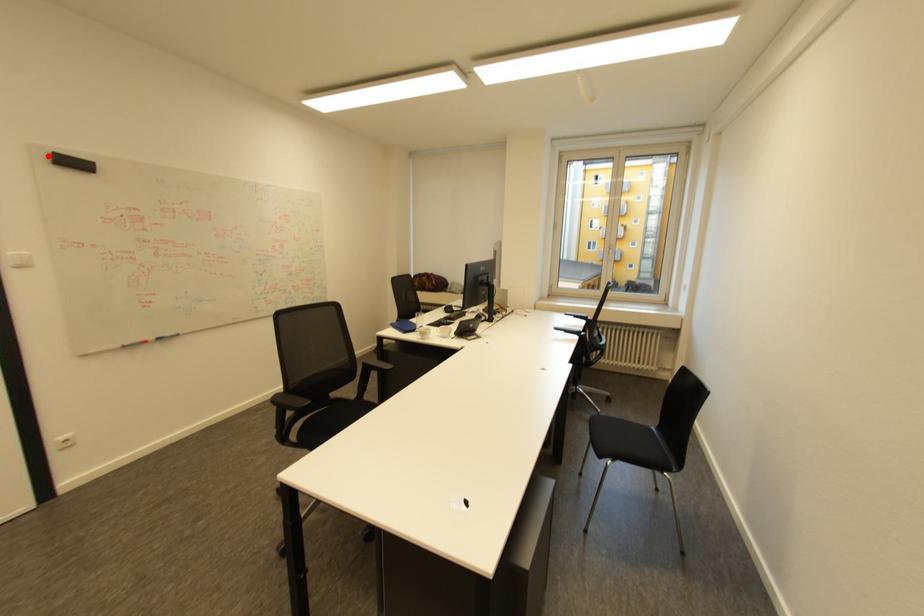
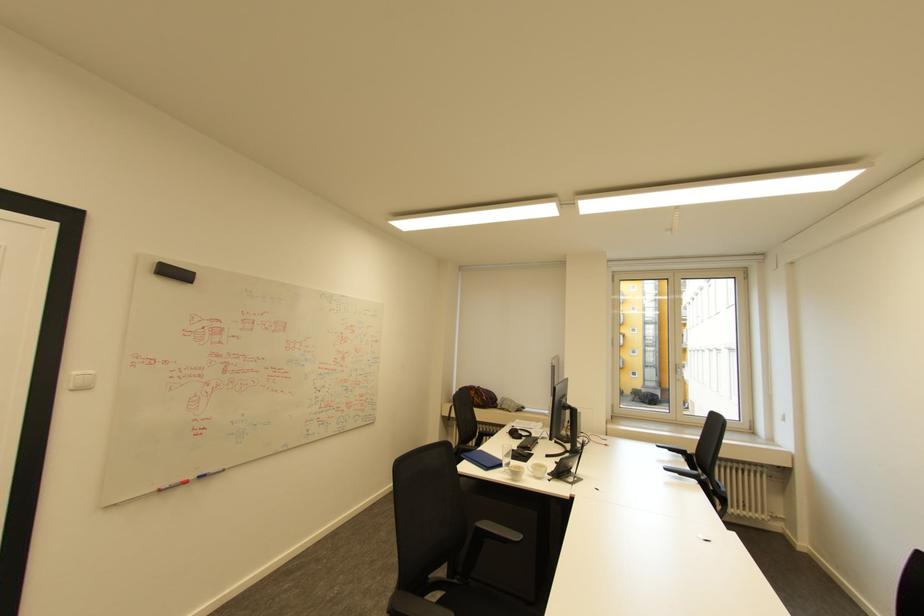
The point at the highlighted location is marked in the first image. Where is the corresponding point in the second image?

(155, 265)